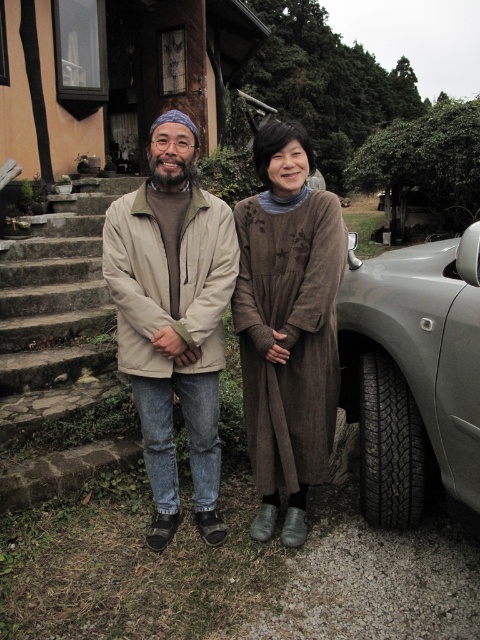
Question: From the image, what is the correct spatial relationship of stone steps at left in relation to black rubber tire at lower right?

Choices:
 (A) left
 (B) right

Answer: (A)

Question: Does beige fabric jacket at center have a smaller size compared to black rubber tire at lower right?

Choices:
 (A) yes
 (B) no

Answer: (B)

Question: Which object appears farthest from the camera in this image?

Choices:
 (A) stone steps at left
 (B) brown textured dress at lower right
 (C) black rubber tire at lower right

Answer: (A)

Question: Which point appears farthest from the camera in this image?

Choices:
 (A) (391, 488)
 (B) (276, 396)
 (C) (417, 419)
 (D) (46, 376)

Answer: (D)

Question: Based on their relative distances, which object is nearer to the stone steps at left?

Choices:
 (A) black rubber tire at lower right
 (B) silver metallic car at right
 (C) beige fabric jacket at center
 (D) brown textured dress at lower right

Answer: (C)

Question: Is the position of stone steps at left more distant than that of black rubber tire at lower right?

Choices:
 (A) yes
 (B) no

Answer: (A)